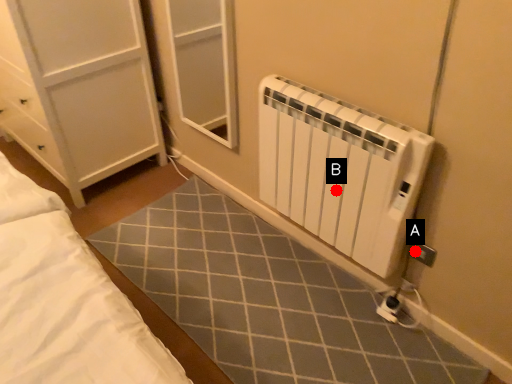
Question: Two points are circled on the image, labeled by A and B beside each circle. Which of the following is the closest to the observer?

Choices:
 (A) A is closer
 (B) B is closer

Answer: (B)